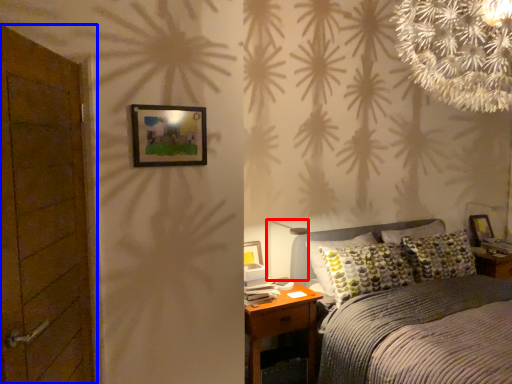
Question: Among these objects, which one is nearest to the camera, table lamp (highlighted by a red box) or door (highlighted by a blue box)?

Choices:
 (A) table lamp
 (B) door

Answer: (B)